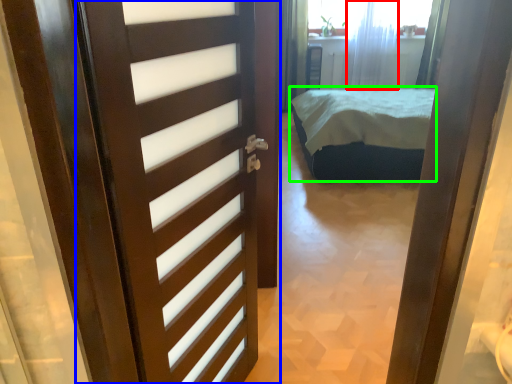
Question: Considering the real-world distances, which object is farthest from curtain (highlighted by a red box)? door (highlighted by a blue box) or bed (highlighted by a green box)?

Choices:
 (A) door
 (B) bed

Answer: (A)